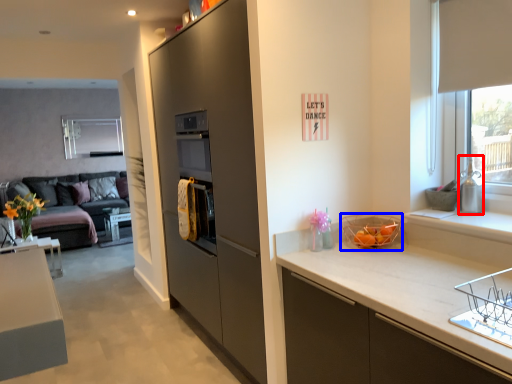
Question: Among these objects, which one is farthest to the camera, appliance (highlighted by a red box) or basket (highlighted by a blue box)?

Choices:
 (A) appliance
 (B) basket

Answer: (B)